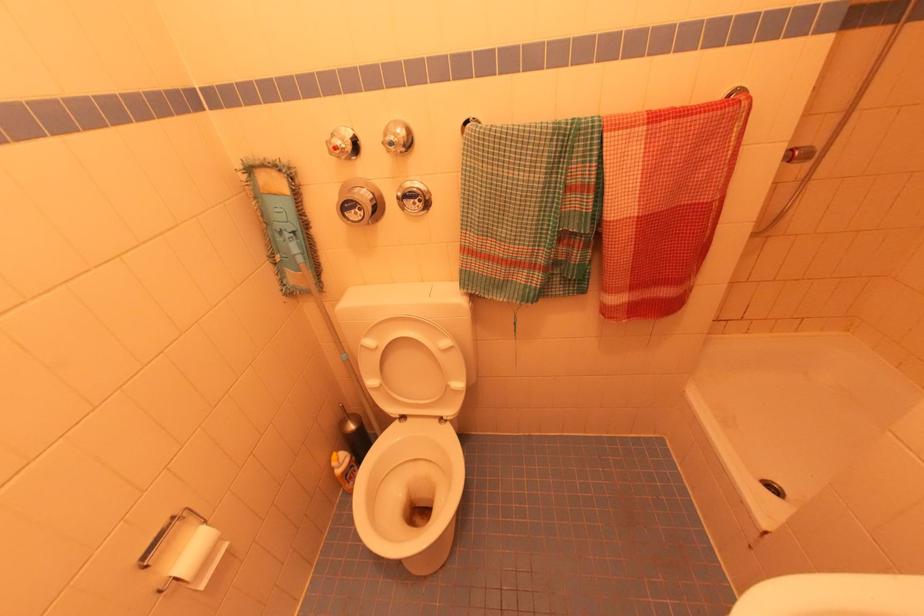
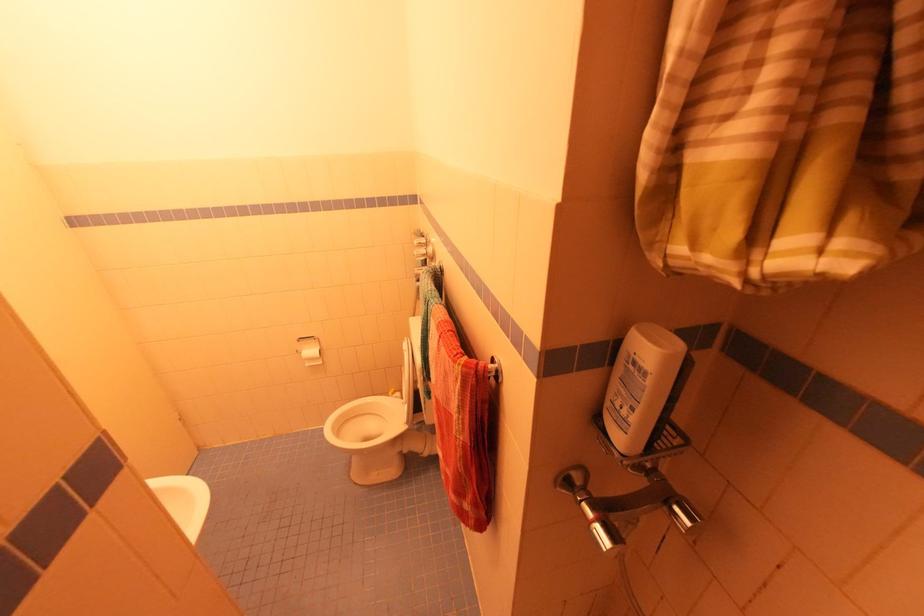
In the second image, find the point that corresponds to point (174, 521) in the first image.

(314, 338)